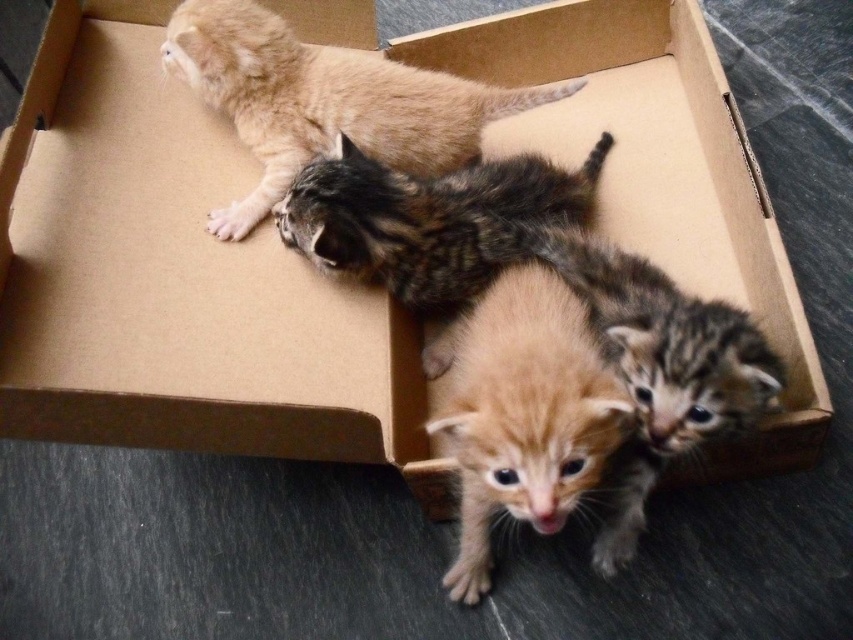
You are holding a 1.5 meter long pole and want to measure the distance from your position to the point marked as point (431, 116). Can you reach it with the pole?

The distance between point (431, 116) and the camera is 1.39 meters. Since the pole is 1.5 meters long, you can reach the point with the pole.